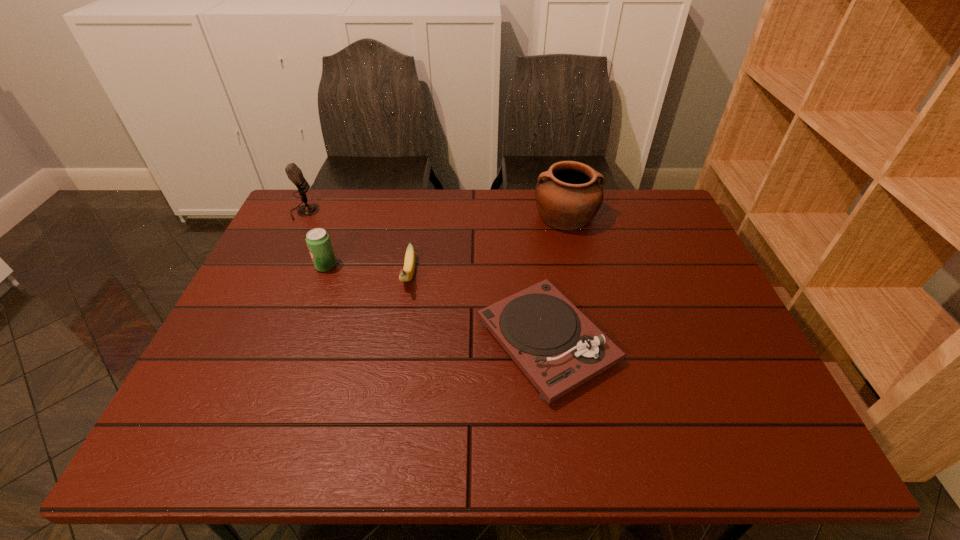
Find the location of a particular element. The height and width of the screenshot is (540, 960). vacant space at the near left corner of the desktop is located at coordinates (234, 430).

Identify the location of vacant space at the near right corner. (731, 419).

Locate an element on the screen. The image size is (960, 540). vacant space that is in between the pottery and the shortest object is located at coordinates (556, 279).

Where is `free spot between the shortest object and the banana`? free spot between the shortest object and the banana is located at coordinates (478, 308).

The height and width of the screenshot is (540, 960). Identify the location of vacant space that is in between the fourth object from right to left and the third object from right to left. (368, 271).

The height and width of the screenshot is (540, 960). I want to click on free area in between the leftmost object and the pottery, so click(435, 214).

The image size is (960, 540). What are the coordinates of `free space between the shortest object and the third tallest object` in the screenshot? It's located at click(x=437, y=303).

Where is `free spot between the leftmost object and the pottery`? This screenshot has height=540, width=960. free spot between the leftmost object and the pottery is located at coordinates (435, 214).

Where is `free spot between the banana and the leftmost object`? The height and width of the screenshot is (540, 960). free spot between the banana and the leftmost object is located at coordinates (356, 244).

Image resolution: width=960 pixels, height=540 pixels. What are the coordinates of `free space that is in between the microphone and the phonograph_record` in the screenshot? It's located at (425, 276).